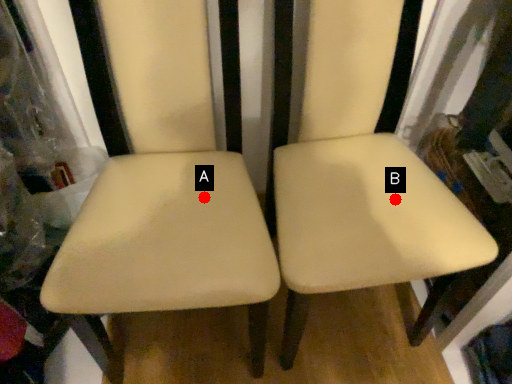
Question: Two points are circled on the image, labeled by A and B beside each circle. Among these points, which one is farthest from the camera?

Choices:
 (A) A is further
 (B) B is further

Answer: (B)